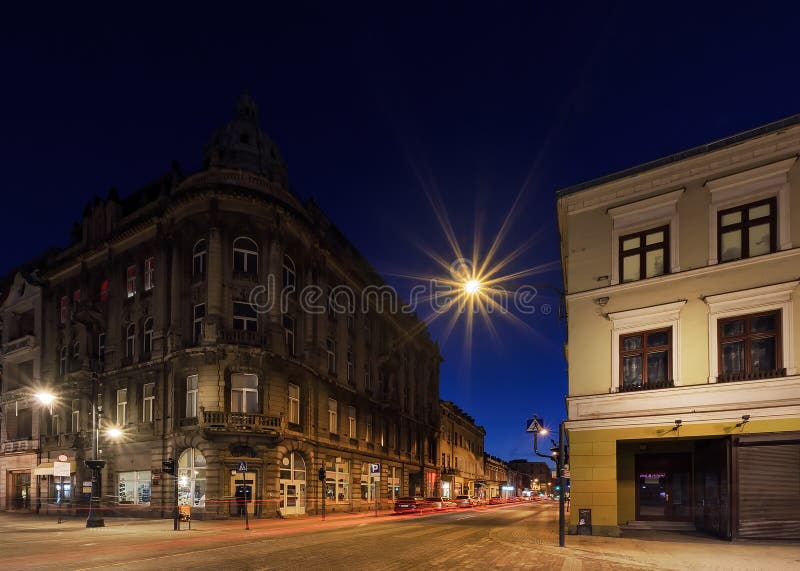
Identify the location of brown apartment. (188, 201).